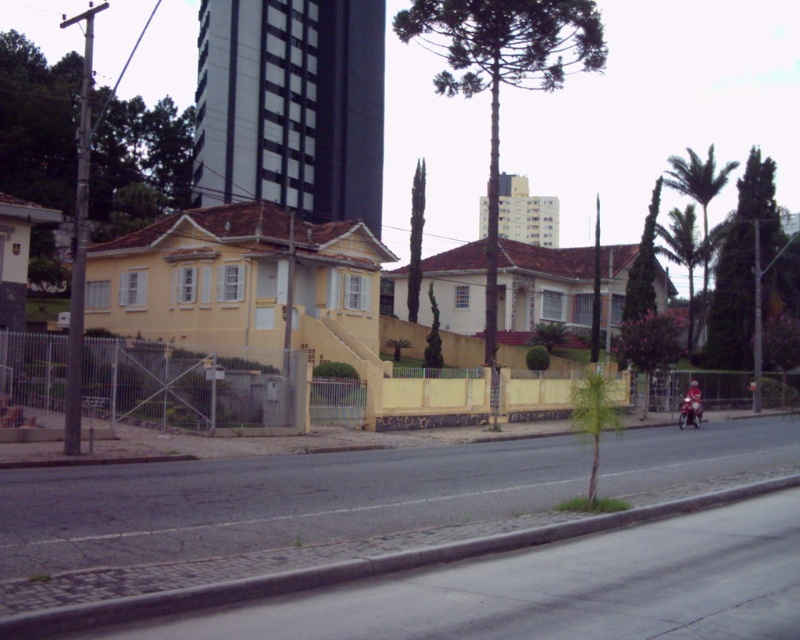
Question: Among these points, which one is nearest to the camera?

Choices:
 (A) (692, 400)
 (B) (678, 420)

Answer: (A)

Question: Is metallic silver motorcycle at center bigger than shiny red motorcycle at center-right?

Choices:
 (A) yes
 (B) no

Answer: (A)

Question: Which of the following is the farthest from the observer?

Choices:
 (A) (692, 390)
 (B) (696, 397)

Answer: (A)

Question: Is the position of metallic silver motorcycle at center less distant than that of shiny red motorcycle at center-right?

Choices:
 (A) yes
 (B) no

Answer: (A)

Question: Among these points, which one is nearest to the camera?

Choices:
 (A) (698, 413)
 (B) (682, 420)

Answer: (B)

Question: Is metallic silver motorcycle at center bigger than shiny red motorcycle at center-right?

Choices:
 (A) yes
 (B) no

Answer: (A)